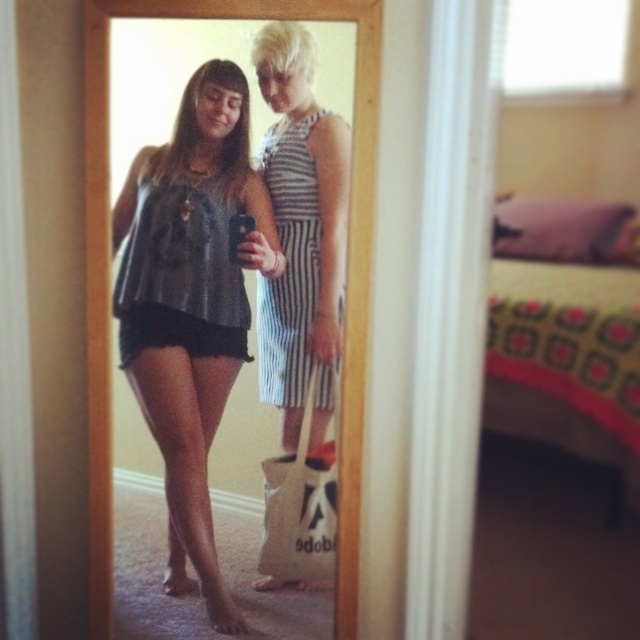
You are a photographer trying to capture a closeup of the matte gray tank top at center and the striped fabric dress at center in the scene. Since you can only focus on one object at a time, which one should you focus on first if you want to ensure both are in focus without moving the camera?

You should focus on the striped fabric dress at center first because it is higher up, so if you focus on it first, the matte gray tank top at center, which is below it, will naturally fall into focus as well.

You are a photographer trying to capture a clear photo of both the matte gray tank top at center and the striped fabric dress at center. Since the camera can only focus on one object at a time, which object should you focus on to ensure the other remains in the background?

You should focus on the matte gray tank top at center because it is closer to the viewer than the striped fabric dress at center, so focusing on it will keep the striped fabric dress at center in the background.

You are a fashion designer analyzing the image of two people taking a selfie in a bedroom. You need to determine the exact location of the matte gray tank top at center. What are its coordinates?

The coordinates of the matte gray tank top at center are at point 0.473 on the x axis and 0.300 on the y axis.